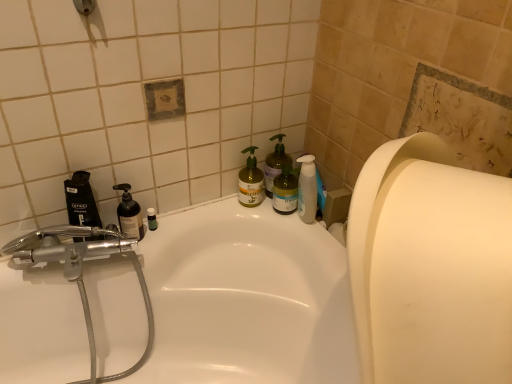
What are the coordinates of `vacant space in front of transparent plastic bottle at left` in the screenshot? It's located at (138, 252).